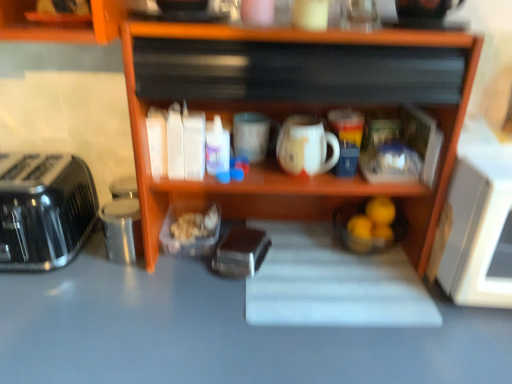
What do you see at coordinates (295, 109) in the screenshot? The width and height of the screenshot is (512, 384). I see `wooden shelf at center` at bounding box center [295, 109].

What do you see at coordinates (44, 210) in the screenshot?
I see `satin black toaster at left` at bounding box center [44, 210].

Where is `smooth gray countertop at center`? Image resolution: width=512 pixels, height=384 pixels. smooth gray countertop at center is located at coordinates (218, 333).

Where is `brushed metal toaster at left`? The image size is (512, 384). brushed metal toaster at left is located at coordinates pos(60,24).

From the image's perspective, does brushed metal toaster at left appear lower than white glossy mug at center?

No, from the image's perspective, brushed metal toaster at left is not below white glossy mug at center.

Identify the location of cabinetry positioned vertically above the white glossy mug at center (from a real-world perspective). Image resolution: width=512 pixels, height=384 pixels. (60, 24).

Can you confirm if brushed metal toaster at left is positioned to the left of white glossy mug at center?

Yes.

Which of these two, brushed metal toaster at left or white glossy mug at center, is wider?

brushed metal toaster at left.

Can you confirm if metallic silver toaster at center is wider than satin black toaster at left?

In fact, metallic silver toaster at center might be narrower than satin black toaster at left.

Is satin black toaster at left surrounded by metallic silver toaster at center?

Definitely not — satin black toaster at left is not inside metallic silver toaster at center.

Does metallic silver toaster at center turn towards satin black toaster at left?

No, metallic silver toaster at center is not oriented towards satin black toaster at left.

Which is more to the right, satin black toaster at left or white matte mug at center?

white matte mug at center is more to the right.

Is satin black toaster at left spatially inside white matte mug at center, or outside of it?

satin black toaster at left is spatially situated outside white matte mug at center.

Considering the sizes of objects satin black toaster at left and white matte mug at center in the image provided, who is wider, satin black toaster at left or white matte mug at center?

satin black toaster at left is wider.

Considering the relative sizes of satin black toaster at left and white matte mug at center in the image provided, is satin black toaster at left taller than white matte mug at center?

Correct, satin black toaster at left is much taller as white matte mug at center.

Is smooth gray countertop at center oriented away from wooden shelf at center?

No, smooth gray countertop at center is not facing the opposite direction of wooden shelf at center.

Does smooth gray countertop at center have a lesser width compared to wooden shelf at center?

No, smooth gray countertop at center is not thinner than wooden shelf at center.

From a real-world perspective, is smooth gray countertop at center located beneath wooden shelf at center?

Yes.

In the image, is smooth gray countertop at center positioned in front of or behind wooden shelf at center?

Visually, smooth gray countertop at center is located in front of wooden shelf at center.

Is metallic silver toaster at center oriented towards white matte mug at center?

No, metallic silver toaster at center is not turned towards white matte mug at center.

At what (x,y) coordinates should I click in order to perform the action: click on mug above the metallic silver toaster at center (from the image's perspective). Please return your answer as a coordinate pair (x, y). The width and height of the screenshot is (512, 384). Looking at the image, I should click on (254, 135).

From the picture: From a real-world perspective, is metallic silver toaster at center positioned above or below white matte mug at center?

Clearly, from a real-world perspective, metallic silver toaster at center is below white matte mug at center.

Could white matte mug at center be considered to be inside metallic silver toaster at center?

No, white matte mug at center is not inside metallic silver toaster at center.

Is smooth gray countertop at center behind brushed metal toaster at left?

Yes, smooth gray countertop at center is behind brushed metal toaster at left.

Is smooth gray countertop at center wider or thinner than brushed metal toaster at left?

smooth gray countertop at center is wider than brushed metal toaster at left.

Measure the distance between smooth gray countertop at center and brushed metal toaster at left.

smooth gray countertop at center and brushed metal toaster at left are 21.39 inches apart from each other.

Locate an element on the screen. This screenshot has width=512, height=384. counter top located underneath the brushed metal toaster at left (from a real-world perspective) is located at coordinates (218, 333).

Does white glossy mug at center contain metallic silver toaster at center?

No, metallic silver toaster at center is not surrounded by white glossy mug at center.

From the image's perspective, is white glossy mug at center located above or below metallic silver toaster at center?

Clearly, from the image's perspective, white glossy mug at center is above metallic silver toaster at center.

This screenshot has width=512, height=384. Identify the location of coffee cup in front of the metallic silver toaster at center. (306, 146).

Is white glossy mug at center far from metallic silver toaster at center?

Actually, white glossy mug at center and metallic silver toaster at center are a little close together.

This screenshot has width=512, height=384. I want to click on cabinetry that appears above the white glossy mug at center (from the image's perspective), so click(x=60, y=24).

This screenshot has height=384, width=512. I want to click on appliance on the right of the satin black toaster at left, so click(241, 252).

Based on their spatial positions, is smooth gray countertop at center or metallic silver toaster at center further from brushed metal toaster at left?

smooth gray countertop at center.

From the image, which object appears to be farther from metallic silver toaster at center, satin black toaster at left or white glossy mug at center?

satin black toaster at left.

When comparing their distances from white glossy mug at center, does satin black toaster at left or brushed metal toaster at left seem closer?

brushed metal toaster at left.

From the image, which object appears to be farther from metallic silver toaster at center, brushed metal toaster at left or smooth gray countertop at center?

brushed metal toaster at left.

From the image, which object appears to be farther from satin black toaster at left, white matte mug at center or smooth gray countertop at center?

The object further to satin black toaster at left is white matte mug at center.

Estimate the real-world distances between objects in this image. Which object is further from white matte mug at center, brushed metal toaster at left or white glossy mug at center?

brushed metal toaster at left lies further to white matte mug at center than the other object.

Estimate the real-world distances between objects in this image. Which object is closer to brushed metal toaster at left, satin black toaster at left or white matte mug at center?

white matte mug at center lies closer to brushed metal toaster at left than the other object.

Considering their positions, is smooth gray countertop at center positioned further to satin black toaster at left than wooden shelf at center?

wooden shelf at center.

At what (x,y) coordinates should I click in order to perform the action: click on coffee cup that lies between brushed metal toaster at left and smooth gray countertop at center from top to bottom. Please return your answer as a coordinate pair (x, y). Looking at the image, I should click on (306, 146).

Identify the location of mug between brushed metal toaster at left and white glossy mug at center in the horizontal direction. This screenshot has width=512, height=384. (254, 135).

The image size is (512, 384). Identify the location of cabinetry situated between satin black toaster at left and wooden shelf at center from left to right. (60, 24).

I want to click on toaster between brushed metal toaster at left and smooth gray countertop at center vertically, so click(44, 210).